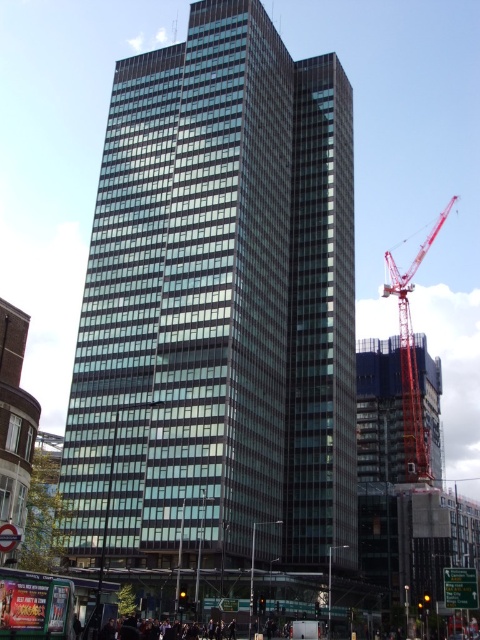
Question: Does glassy steel skyscraper at center have a smaller size compared to red metallic crane at right?

Choices:
 (A) no
 (B) yes

Answer: (B)

Question: Is glassy steel skyscraper at center wider than red metallic crane at right?

Choices:
 (A) no
 (B) yes

Answer: (A)

Question: Which point is closer to the camera?

Choices:
 (A) red metallic crane at right
 (B) glassy steel skyscraper at center

Answer: (B)

Question: Which point is farther from the camera taking this photo?

Choices:
 (A) (232, 266)
 (B) (409, 269)

Answer: (B)

Question: Does glassy steel skyscraper at center have a greater width compared to red metallic crane at right?

Choices:
 (A) no
 (B) yes

Answer: (A)